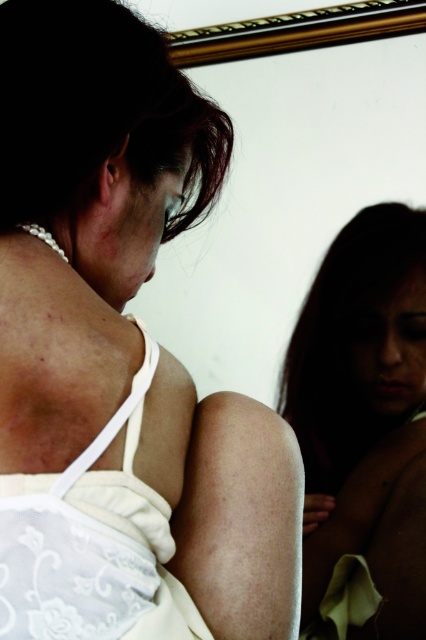
You are a fashion designer looking at a client trying on outfits. You see the white lace dress at center and the white lace wedding dress at upper left. Which one is bigger in size?

The white lace dress at center is larger in size compared to the white lace wedding dress at upper left.

You are a fashion designer who needs to arrange two dresses for a photoshoot. The scene has a white lace dress at center and a white lace wedding dress at upper left. Given that the two dresses are 3.71 inches apart in the image, can you place a 4.5 inch wide mannequin between them without overlapping?

The white lace dress at center and white lace wedding dress at upper left are 3.71 inches apart. Since the mannequin is 4.5 inches wide, it cannot fit between them without overlapping because the distance between the dresses is smaller than the mannequin width.